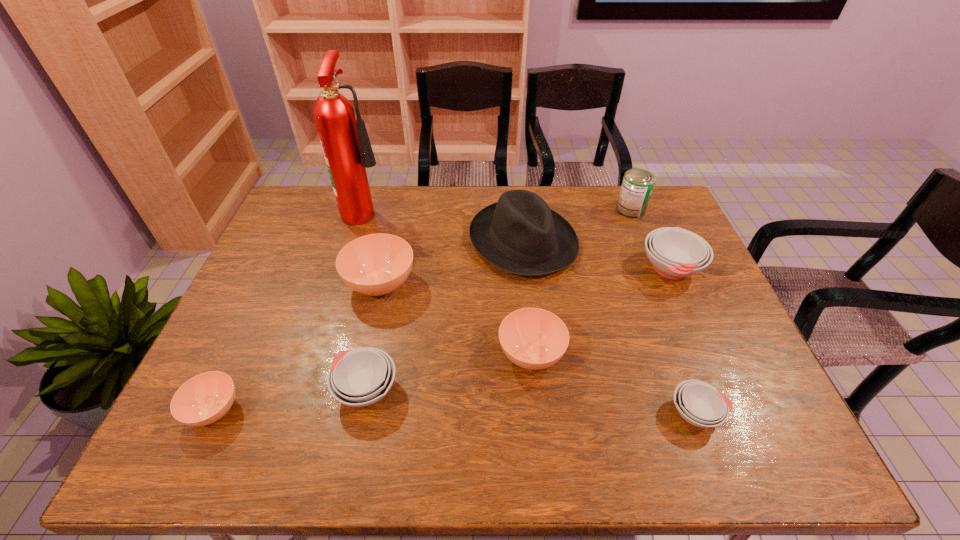
The image size is (960, 540). I want to click on the leftmost object, so click(x=204, y=399).

Where is `the nearest peach soup bowl`? Image resolution: width=960 pixels, height=540 pixels. the nearest peach soup bowl is located at coordinates (204, 399).

The height and width of the screenshot is (540, 960). What are the coordinates of `the smallest white soup bowl` in the screenshot? It's located at (700, 404).

Locate an element on the screen. The height and width of the screenshot is (540, 960). free location located at the nozzle of the tallest object is located at coordinates (464, 209).

You are a GUI agent. You are given a task and a screenshot of the screen. Output one action in this format:
    pyautogui.click(x=<x>, y=<y>)
    Task: Click on the free location located on the left of the fedora
    
    Given the screenshot: What is the action you would take?
    pyautogui.click(x=414, y=241)

The image size is (960, 540). Identify the location of vacant space situated on the front of the can. (659, 278).

This screenshot has width=960, height=540. I want to click on vacant space positioned 0.340m on the right of the biggest peach soup bowl, so click(534, 284).

Find the location of a particular element. The image size is (960, 540). vacant space located 0.070m on the left of the biggest white soup bowl is located at coordinates (616, 269).

Where is `free space located on the back of the second farthest peach soup bowl`? The image size is (960, 540). free space located on the back of the second farthest peach soup bowl is located at coordinates (523, 275).

Where is `vacant space situated 0.300m on the right of the leftmost white soup bowl`? The image size is (960, 540). vacant space situated 0.300m on the right of the leftmost white soup bowl is located at coordinates (526, 390).